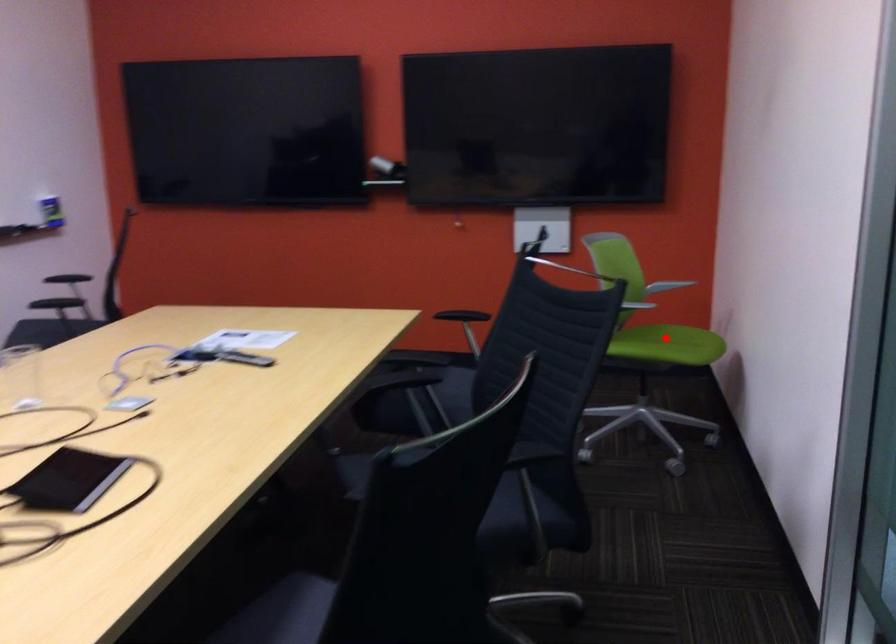
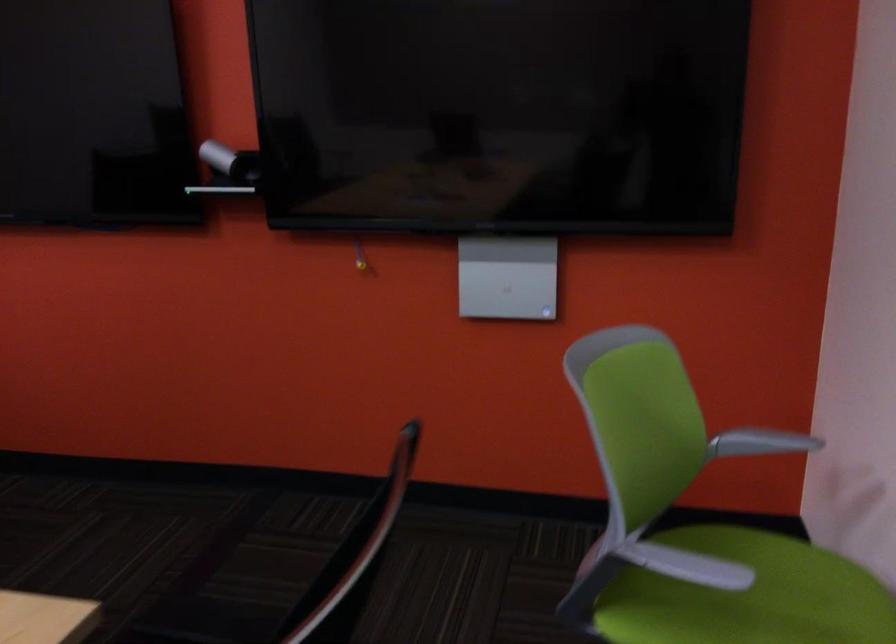
Find the pixel in the second image that matches the highlighted location in the first image.

(747, 596)